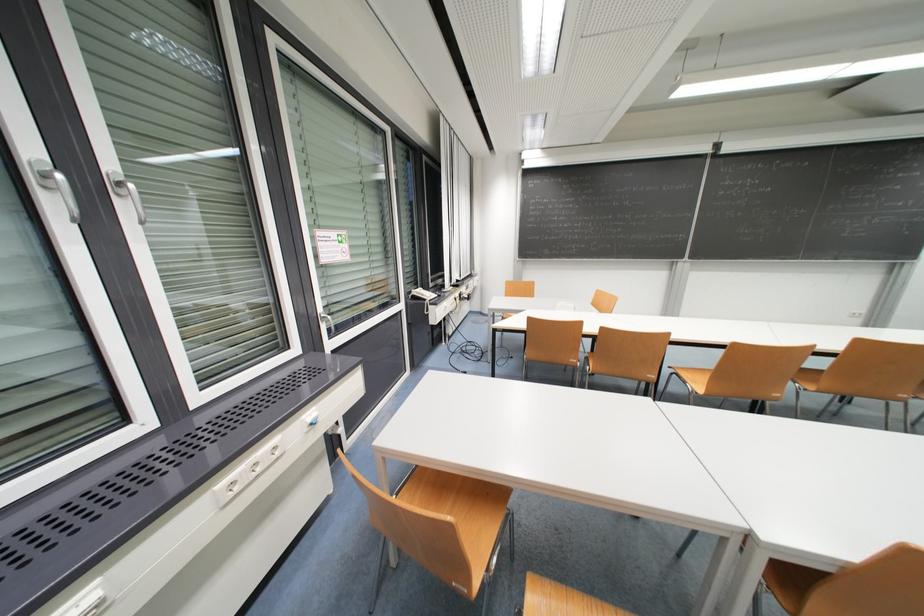
Find where to lift the telephone handset. Please return your answer as a coordinate pair (x, y).

(421, 294)